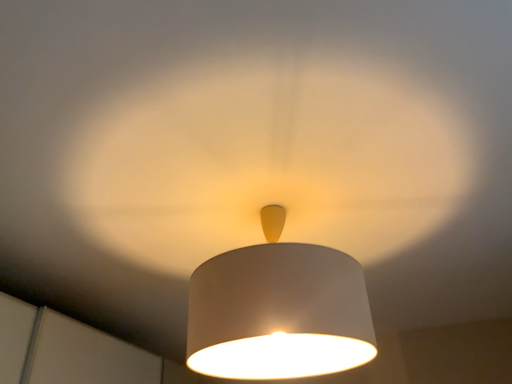
Question: From a real-world perspective, is white matte lampshade at center physically located above or below matte white lampshade at center?

Choices:
 (A) below
 (B) above

Answer: (A)

Question: Does point tap(279, 279) appear closer or farther from the camera than point tap(177, 263)?

Choices:
 (A) closer
 (B) farther

Answer: (A)

Question: From the image's perspective, is white matte lampshade at center above or below matte white lampshade at center?

Choices:
 (A) above
 (B) below

Answer: (A)

Question: Is matte white lampshade at center in front of or behind white matte lampshade at center in the image?

Choices:
 (A) behind
 (B) front

Answer: (B)

Question: Do you think matte white lampshade at center is within white matte lampshade at center, or outside of it?

Choices:
 (A) outside
 (B) inside

Answer: (A)

Question: From a real-world perspective, is matte white lampshade at center physically located above or below white matte lampshade at center?

Choices:
 (A) above
 (B) below

Answer: (A)

Question: Visually, is matte white lampshade at center positioned to the left or to the right of white matte lampshade at center?

Choices:
 (A) left
 (B) right

Answer: (A)